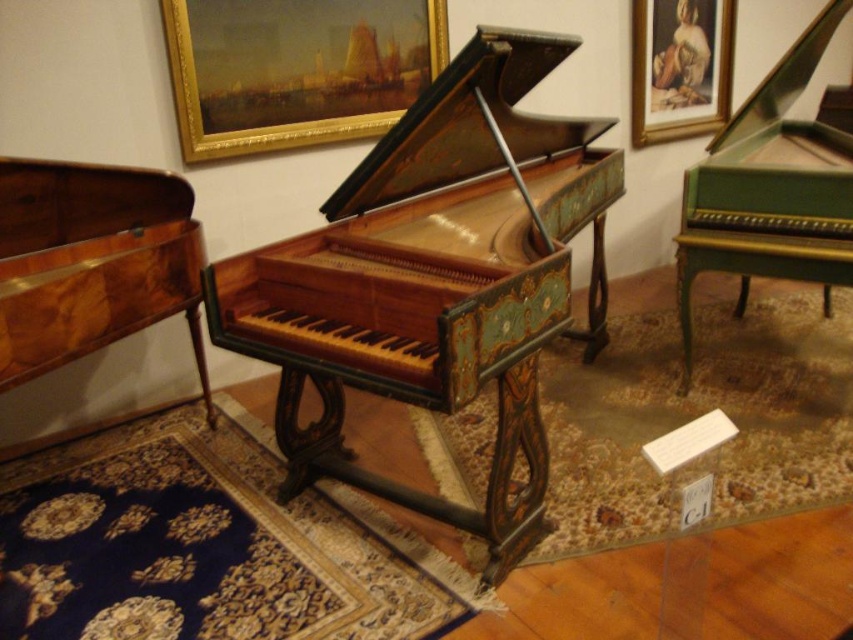
Who is shorter, green polished wood harpsichord at right or matte gold picture frame at upper right?

With less height is matte gold picture frame at upper right.

Does green polished wood harpsichord at right have a smaller size compared to matte gold picture frame at upper right?

No, green polished wood harpsichord at right is not smaller than matte gold picture frame at upper right.

What do you see at coordinates (770, 189) in the screenshot? The image size is (853, 640). I see `green polished wood harpsichord at right` at bounding box center [770, 189].

Where is `green polished wood harpsichord at right`? green polished wood harpsichord at right is located at coordinates (770, 189).

How distant is wooden piano at center from gold-framed painting at upper center?

wooden piano at center is 4.08 feet away from gold-framed painting at upper center.

Is wooden piano at center to the right of gold-framed painting at upper center from the viewer's perspective?

Correct, you'll find wooden piano at center to the right of gold-framed painting at upper center.

Which is behind, point (567, 301) or point (345, 74)?

Positioned behind is point (345, 74).

This screenshot has width=853, height=640. I want to click on wooden piano at center, so click(434, 280).

Which of these two, wooden piano at center or matte gold picture frame at upper right, stands shorter?

matte gold picture frame at upper right is shorter.

Measure the distance between point (496, 252) and camera.

2.33 meters

Locate an element on the screen. Image resolution: width=853 pixels, height=640 pixels. wooden piano at center is located at coordinates (434, 280).